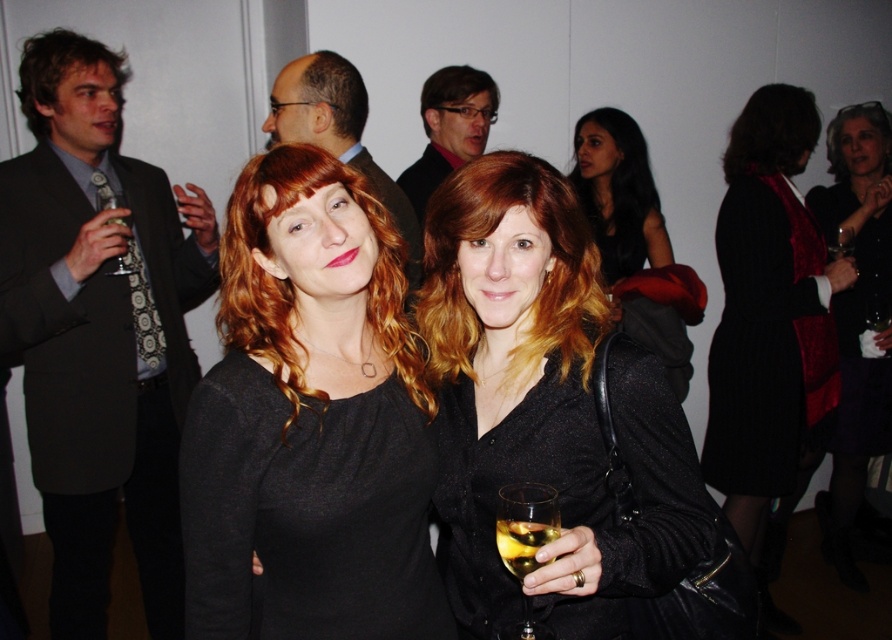
Question: Is black pinstripe dress at right to the right of sleek brown hair at center from the viewer's perspective?

Choices:
 (A) yes
 (B) no

Answer: (A)

Question: Estimate the real-world distances between objects in this image. Which object is closer to the matte black shirt at center?

Choices:
 (A) sleek brown hair at center
 (B) clear glass wine glass at left
 (C) clear glass wine glass at center
 (D) black textured dress at center

Answer: (A)

Question: Which object appears farthest from the camera in this image?

Choices:
 (A) translucent glass wine at center
 (B) clear glass wine glass at left

Answer: (B)

Question: Can you confirm if black matte dress at center is smaller than clear glass wine glass at left?

Choices:
 (A) no
 (B) yes

Answer: (A)

Question: Is black matte dress at center further to the viewer compared to matte black shirt at center?

Choices:
 (A) no
 (B) yes

Answer: (A)

Question: Which object is the closest to the black pinstripe dress at right?

Choices:
 (A) clear glass wine glass at center
 (B) sleek brown hair at center

Answer: (B)